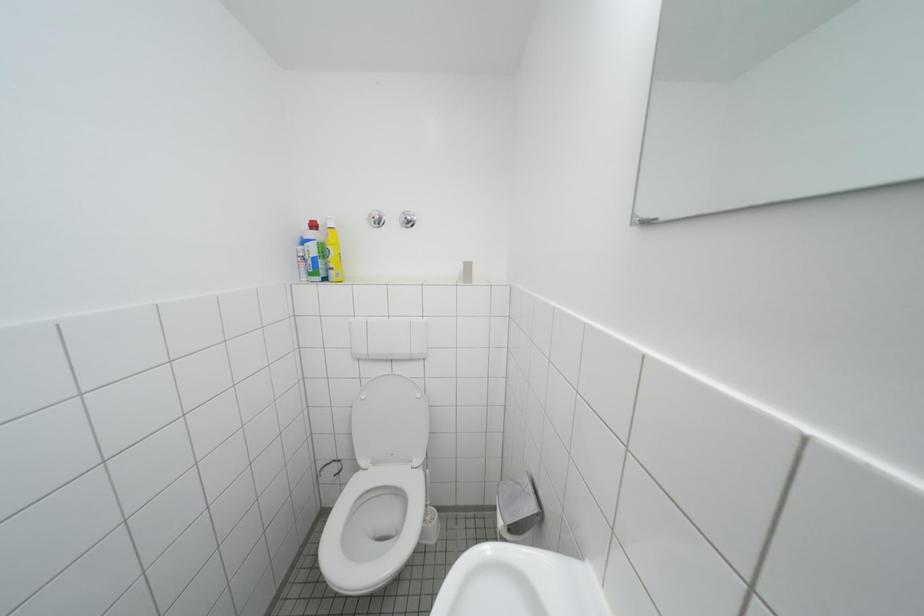
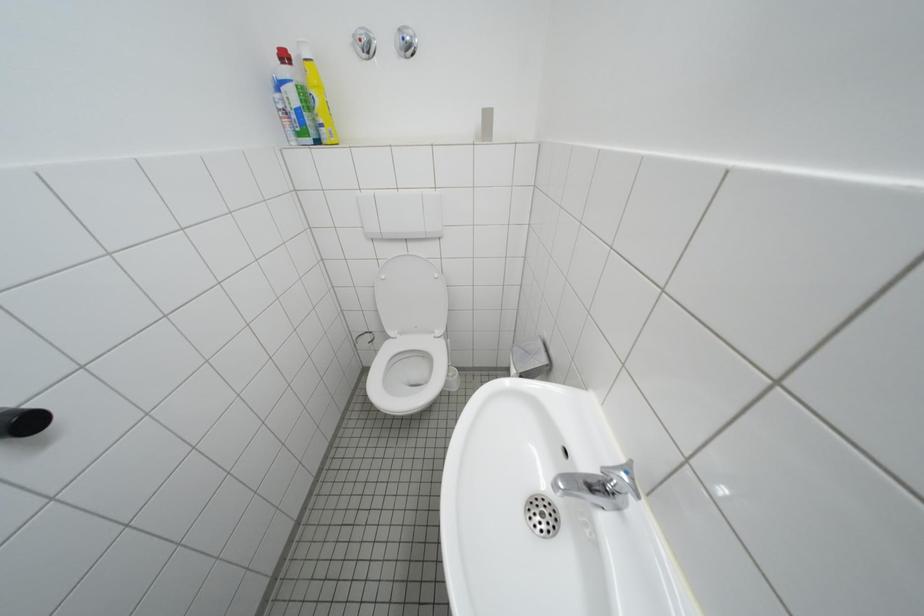
In a continuous first-person perspective shot, in which direction is the camera moving?

The cameraman moved toward left, forward.